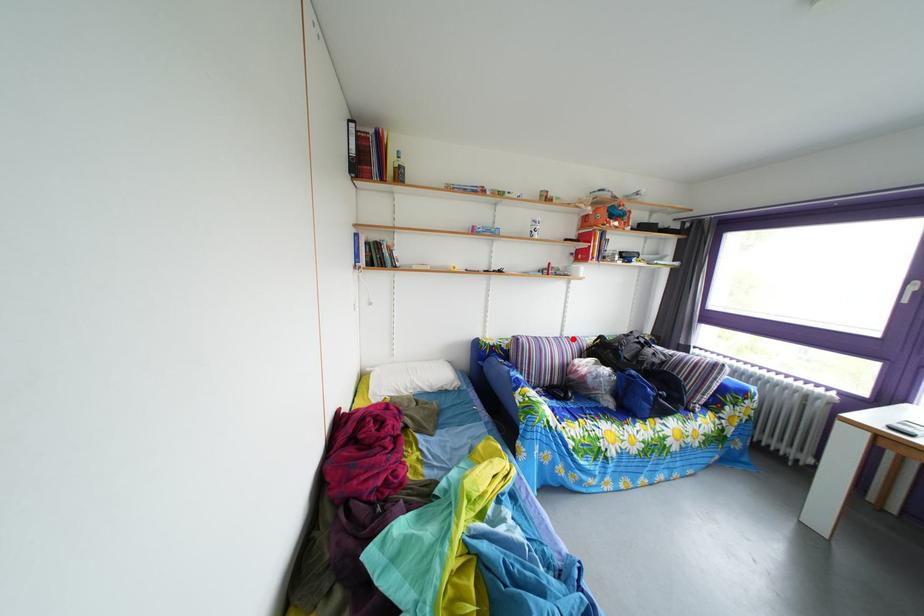
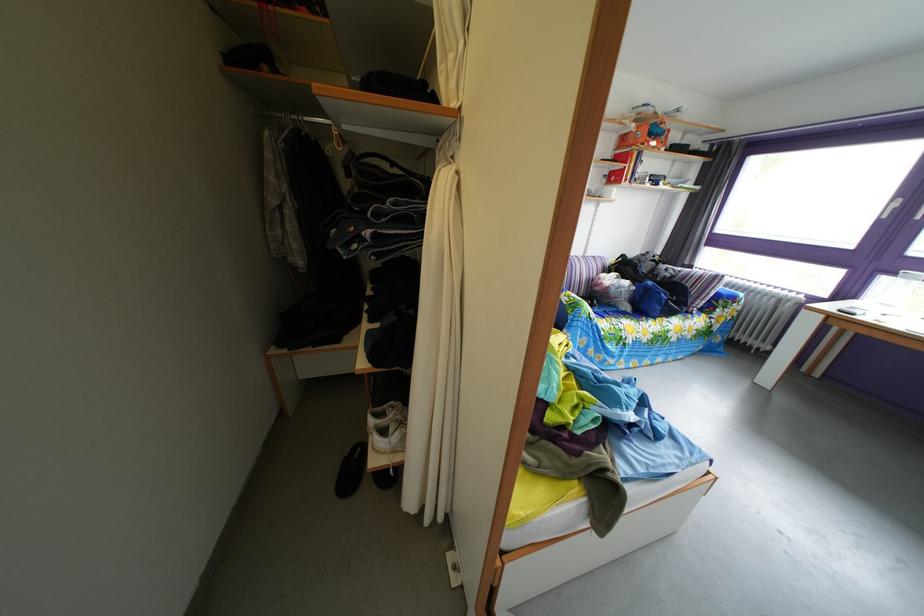
The point at the highlighted location is marked in the first image. Where is the corresponding point in the second image?

(596, 261)